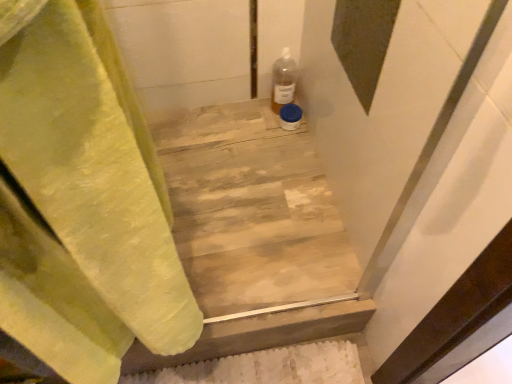
Question: Is translucent plastic bottle at upper right positioned with its back to wooden at center?

Choices:
 (A) no
 (B) yes

Answer: (A)

Question: Can you confirm if translucent plastic bottle at upper right is positioned to the left of wooden at center?

Choices:
 (A) yes
 (B) no

Answer: (B)

Question: Does translucent plastic bottle at upper right turn towards wooden at center?

Choices:
 (A) no
 (B) yes

Answer: (A)

Question: Is translucent plastic bottle at upper right far away from wooden at center?

Choices:
 (A) no
 (B) yes

Answer: (A)

Question: Considering the relative sizes of translucent plastic bottle at upper right and wooden at center in the image provided, is translucent plastic bottle at upper right bigger than wooden at center?

Choices:
 (A) yes
 (B) no

Answer: (B)

Question: Is translucent plastic bottle at upper right placed right next to wooden at center?

Choices:
 (A) yes
 (B) no

Answer: (B)

Question: Are wooden at center and translucent plastic bottle at upper right far apart?

Choices:
 (A) yes
 (B) no

Answer: (B)

Question: Is wooden at center bigger than translucent plastic bottle at upper right?

Choices:
 (A) no
 (B) yes

Answer: (B)

Question: From a real-world perspective, is wooden at center under translucent plastic bottle at upper right?

Choices:
 (A) no
 (B) yes

Answer: (B)

Question: From the image's perspective, is wooden at center under translucent plastic bottle at upper right?

Choices:
 (A) no
 (B) yes

Answer: (B)

Question: Is wooden at center shorter than translucent plastic bottle at upper right?

Choices:
 (A) no
 (B) yes

Answer: (B)

Question: Can you confirm if wooden at center is positioned to the left of translucent plastic bottle at upper right?

Choices:
 (A) no
 (B) yes

Answer: (B)

Question: Is wooden at center bigger or smaller than translucent plastic bottle at upper right?

Choices:
 (A) small
 (B) big

Answer: (B)